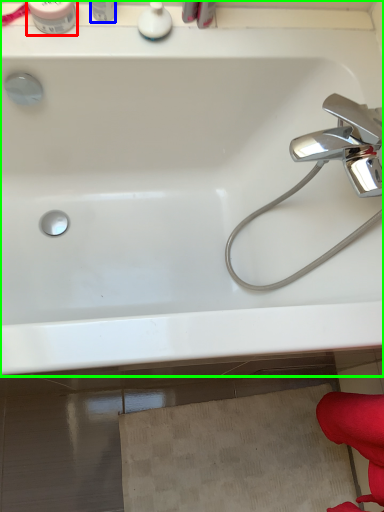
Question: Considering the real-world distances, which object is farthest from toiletry (highlighted by a red box)? toiletry (highlighted by a blue box) or bathtub (highlighted by a green box)?

Choices:
 (A) toiletry
 (B) bathtub

Answer: (B)